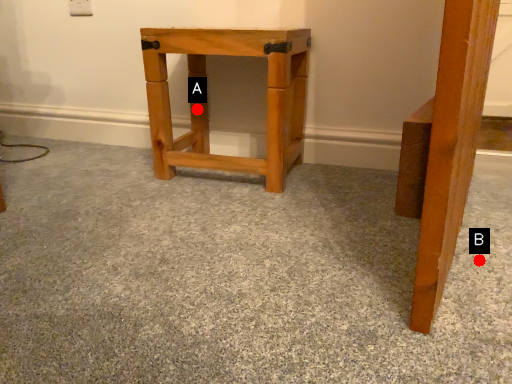
Question: Two points are circled on the image, labeled by A and B beside each circle. Among these points, which one is nearest to the camera?

Choices:
 (A) A is closer
 (B) B is closer

Answer: (B)